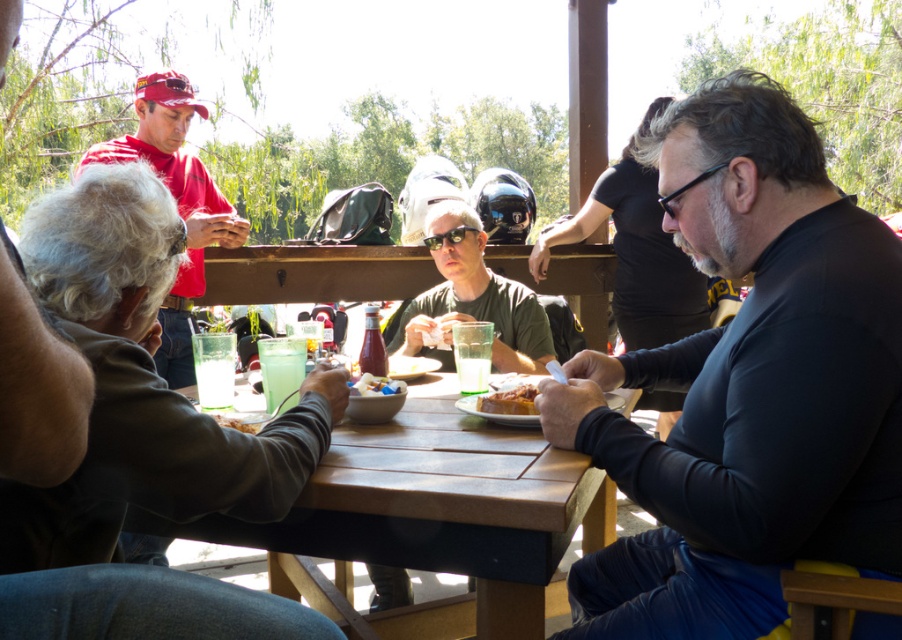
Consider the image. Can you confirm if matte red shirt at upper left is thinner than brown crispy bread at center?

In fact, matte red shirt at upper left might be wider than brown crispy bread at center.

Can you confirm if matte red shirt at upper left is positioned above brown crispy bread at center?

Correct, matte red shirt at upper left is located above brown crispy bread at center.

Identify the location of matte red shirt at upper left. (34, 390).

Find the location of `matte red shirt at upper left`. matte red shirt at upper left is located at coordinates (34, 390).

Consider the image. Does smooth plastic bowl at center have a lesser width compared to brown crumbly bread at lower left?

Yes.

Who is positioned more to the left, smooth plastic bowl at center or brown crumbly bread at lower left?

From the viewer's perspective, brown crumbly bread at lower left appears more on the left side.

Which is behind, point (367, 374) or point (241, 422)?

Point (367, 374)

At what (x,y) coordinates should I click in order to perform the action: click on smooth plastic bowl at center. Please return your answer as a coordinate pair (x, y). Looking at the image, I should click on click(x=376, y=385).

From the picture: Is matte red shirt at upper left bigger than red matte cap at upper left?

Incorrect, matte red shirt at upper left is not larger than red matte cap at upper left.

Can you confirm if matte red shirt at upper left is positioned above red matte cap at upper left?

No.

Does point (354, 620) come closer to viewer compared to point (232, 237)?

That is True.

Locate an element on the screen. matte red shirt at upper left is located at coordinates (34, 390).